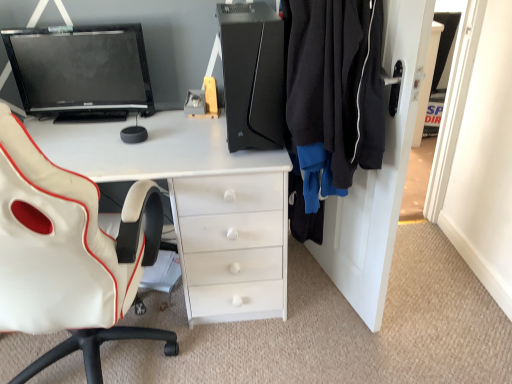
The width and height of the screenshot is (512, 384). I want to click on vacant space to the left of black matte computer tower at center, so click(x=185, y=135).